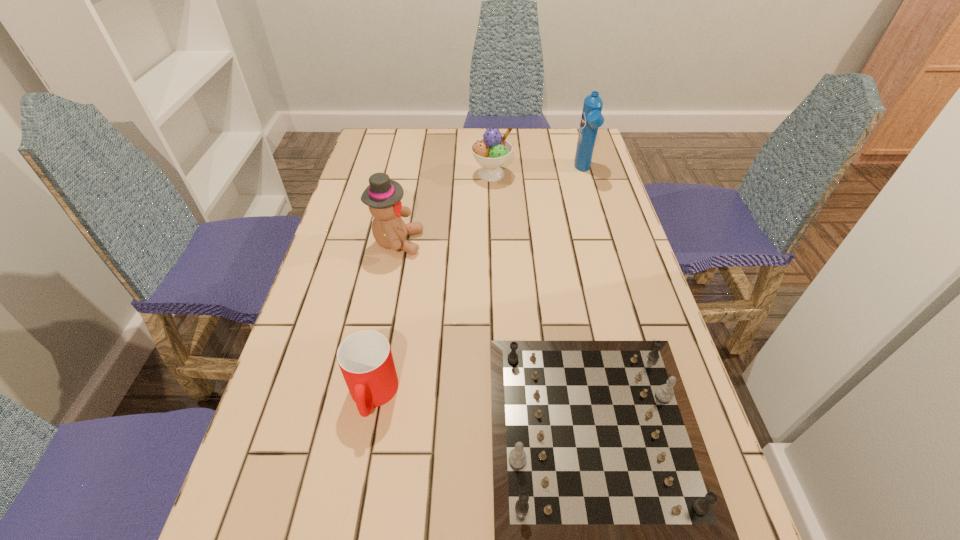
What are the coordinates of `shampoo` in the screenshot? It's located at (592, 118).

This screenshot has height=540, width=960. Identify the location of rag_doll. (383, 196).

Locate an element on the screen. Image resolution: width=960 pixels, height=540 pixels. the third farthest object is located at coordinates (383, 196).

Where is `the third tallest object`? The image size is (960, 540). the third tallest object is located at coordinates (492, 151).

The height and width of the screenshot is (540, 960). Identify the location of the fourth tallest object. (365, 358).

At what (x,y) coordinates should I click in order to perform the action: click on free location located 0.080m on the front of the tallest object. Please return your answer as a coordinate pair (x, y). Looking at the image, I should click on (591, 198).

Locate an element on the screen. This screenshot has width=960, height=540. blank space located 0.110m on the front-facing side of the rag_doll is located at coordinates (462, 242).

I want to click on free region located 0.400m on the front of the icecream, so click(494, 276).

Locate an element on the screen. This screenshot has width=960, height=540. free space located 0.180m on the side of the second shortest object with the handle is located at coordinates (348, 534).

Where is `shampoo positioned at the far edge`? Image resolution: width=960 pixels, height=540 pixels. shampoo positioned at the far edge is located at coordinates (592, 118).